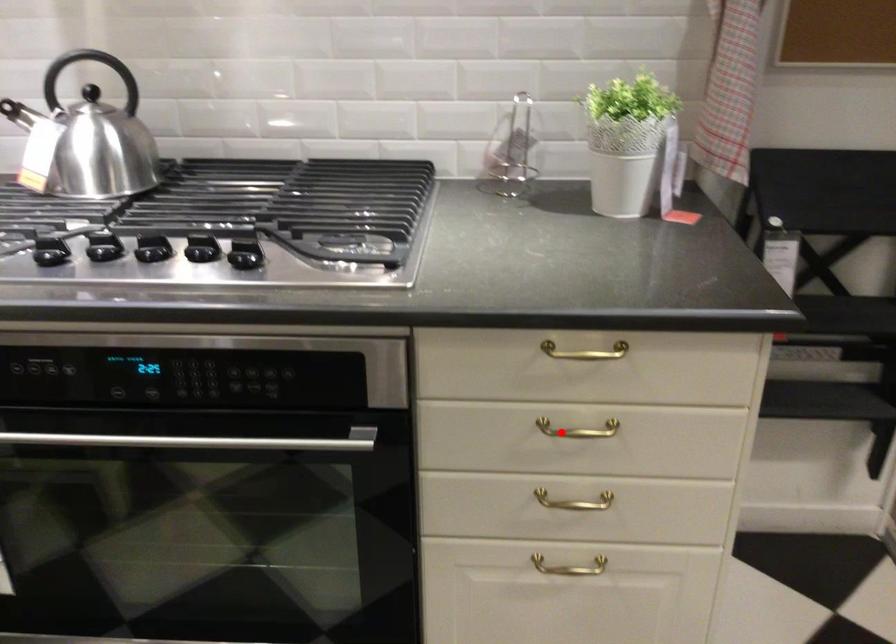
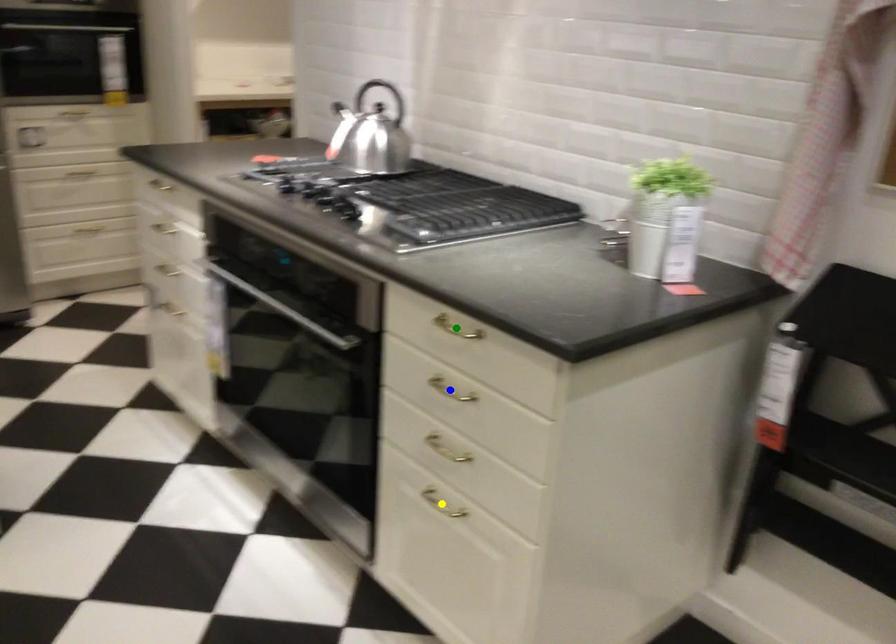
Question: I am providing you with two images of the same scene from different viewpoints. A red point is marked on the first image. You are given multiple points on the second image. In image 2, which mark is for the same physical point as the one in image 1?

Choices:
 (A) yellow point
 (B) green point
 (C) blue point

Answer: (C)